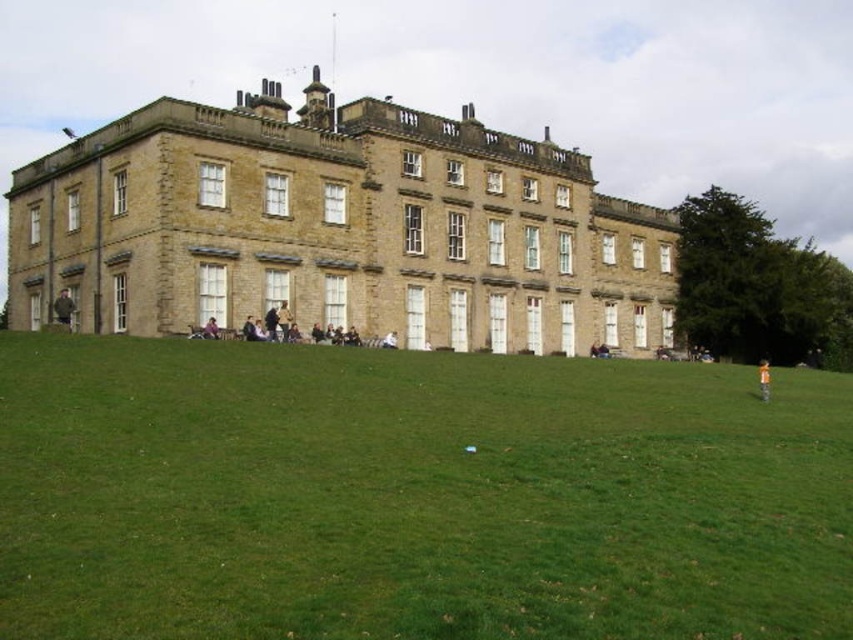
Can you confirm if green grass at lower center is thinner than dark purple shirt at center?

Incorrect, green grass at lower center's width is not less than dark purple shirt at center's.

Based on the photo, which is more to the left, green grass at lower center or dark purple shirt at center?

dark purple shirt at center is more to the left.

Between point (671, 481) and point (207, 330), which one is positioned in front?

Point (671, 481) is more forward.

Locate an element on the screen. The height and width of the screenshot is (640, 853). green grass at lower center is located at coordinates (415, 496).

Is orange fabric person at lower right positioned in front of dark purple shirt at center?

No, orange fabric person at lower right is further to the viewer.

Is point (762, 364) less distant than point (213, 321)?

No.

Image resolution: width=853 pixels, height=640 pixels. What are the coordinates of `orange fabric person at lower right` in the screenshot? It's located at (763, 380).

Find the location of a particular element. The image size is (853, 640). orange fabric person at lower right is located at coordinates (763, 380).

Which of these two, dark brown leather jacket at lower left or orange fabric person at lower right, stands shorter?

With less height is orange fabric person at lower right.

Is dark brown leather jacket at lower left shorter than orange fabric person at lower right?

Incorrect, dark brown leather jacket at lower left's height does not fall short of orange fabric person at lower right's.

Measure the distance between dark brown leather jacket at lower left and camera.

They are 53.45 meters apart.

Where is `dark brown leather jacket at lower left`? This screenshot has width=853, height=640. dark brown leather jacket at lower left is located at coordinates (62, 307).